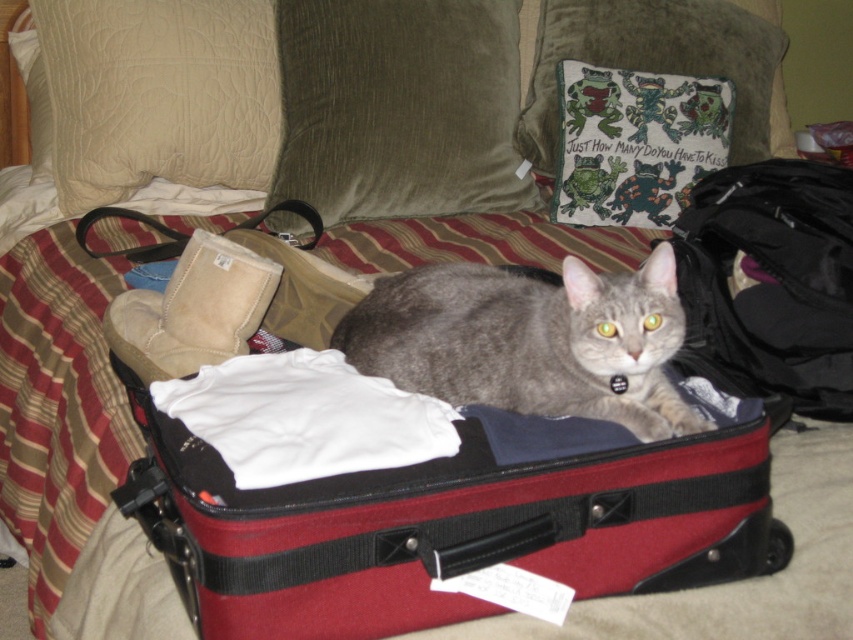
Where is `velvety olive green pillow at upper center`? The width and height of the screenshot is (853, 640). velvety olive green pillow at upper center is located at coordinates (399, 108).

Is velvety olive green pillow at upper center shorter than white fabric at center?

No, velvety olive green pillow at upper center is not shorter than white fabric at center.

You are a GUI agent. You are given a task and a screenshot of the screen. Output one action in this format:
    pyautogui.click(x=<x>, y=<y>)
    Task: Click on the velvety olive green pillow at upper center
    
    Given the screenshot: What is the action you would take?
    pyautogui.click(x=399, y=108)

Is velvety olive green pillow at upper center to the left of green fabric pillow with frogs at upper center from the viewer's perspective?

Correct, you'll find velvety olive green pillow at upper center to the left of green fabric pillow with frogs at upper center.

In the scene shown: Does velvety olive green pillow at upper center have a greater height compared to green fabric pillow with frogs at upper center?

Yes, velvety olive green pillow at upper center is taller than green fabric pillow with frogs at upper center.

Identify the location of velvety olive green pillow at upper center. (399, 108).

Does gray fur cat at center have a greater height compared to green fabric pillow with frogs at upper center?

In fact, gray fur cat at center may be shorter than green fabric pillow with frogs at upper center.

Is point (378, 301) more distant than point (524, 150)?

No, it is not.

The width and height of the screenshot is (853, 640). What are the coordinates of `gray fur cat at center` in the screenshot? It's located at coord(531,340).